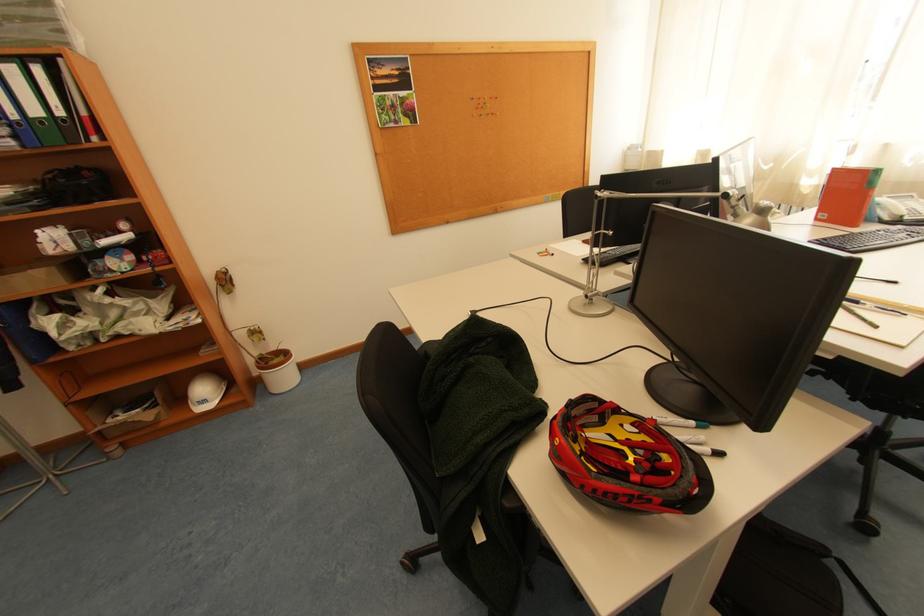
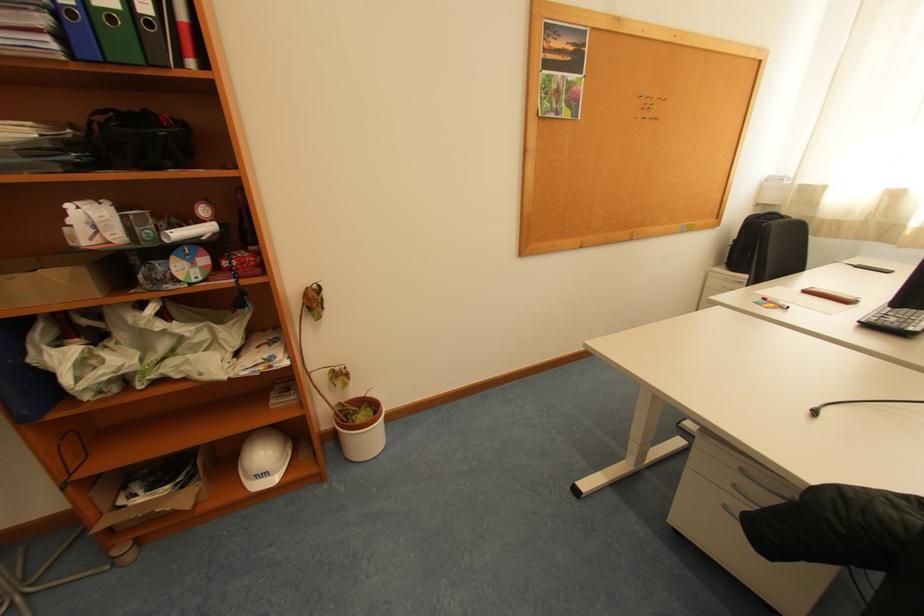
The images are taken continuously from a first-person perspective. In which direction are you moving?

The movement direction of the cameraman is left, forward.